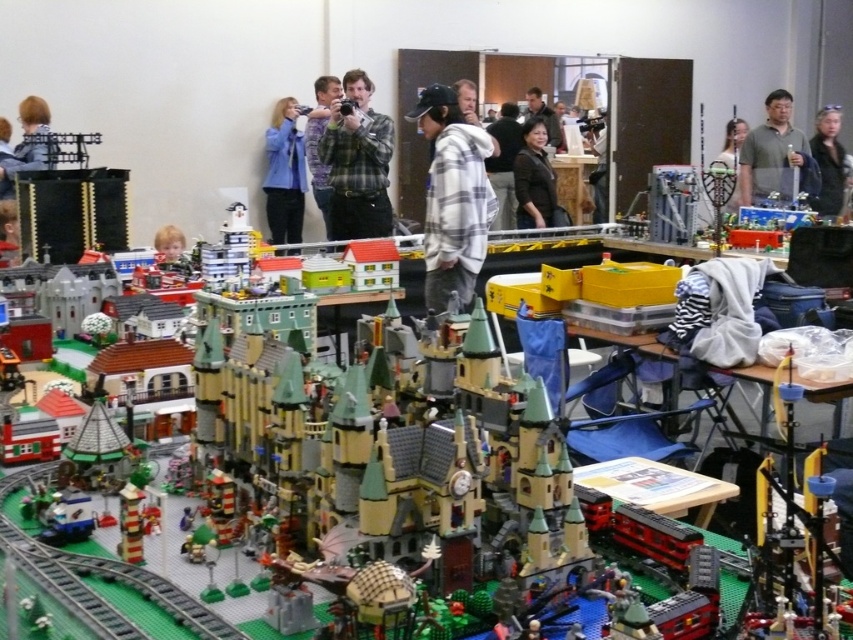
Identify the location of black leather jacket at upper right. (828, 163).

Which is below, black leather jacket at upper right or white plaid shirt at center?

Positioned lower is black leather jacket at upper right.

Locate an element on the screen. black leather jacket at upper right is located at coordinates (828, 163).

Can you confirm if plaid hoodie at center is positioned to the left of plaid shirt at center?

No, plaid hoodie at center is not to the left of plaid shirt at center.

Locate an element on the screen. plaid hoodie at center is located at coordinates (453, 196).

Who is lower down, matte blue jacket at upper center or matte gray shirt at center?

matte blue jacket at upper center is lower down.

Is matte blue jacket at upper center thinner than matte gray shirt at center?

No, matte blue jacket at upper center is not thinner than matte gray shirt at center.

Image resolution: width=853 pixels, height=640 pixels. What do you see at coordinates (283, 173) in the screenshot?
I see `matte blue jacket at upper center` at bounding box center [283, 173].

I want to click on matte blue jacket at upper center, so click(283, 173).